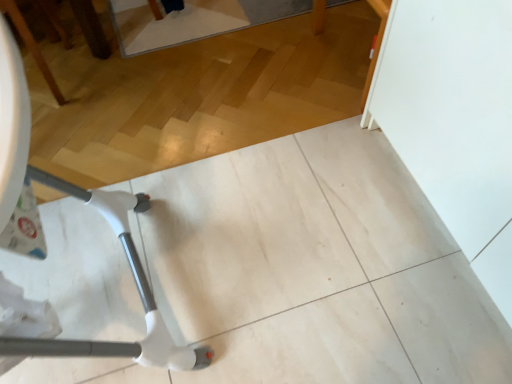
I want to click on blank area beneath wooden table at upper left (from a real-world perspective), so click(x=46, y=76).